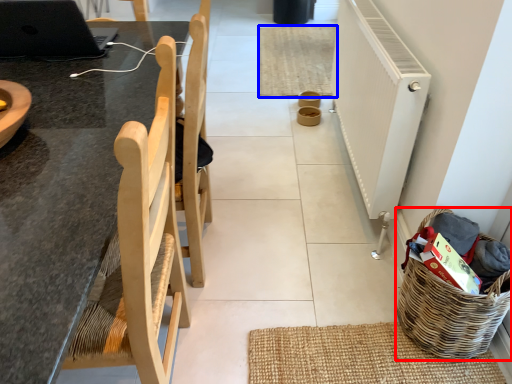
Question: Which of the following is the closest to the observer, basket (highlighted by a red box) or mat (highlighted by a blue box)?

Choices:
 (A) basket
 (B) mat

Answer: (A)